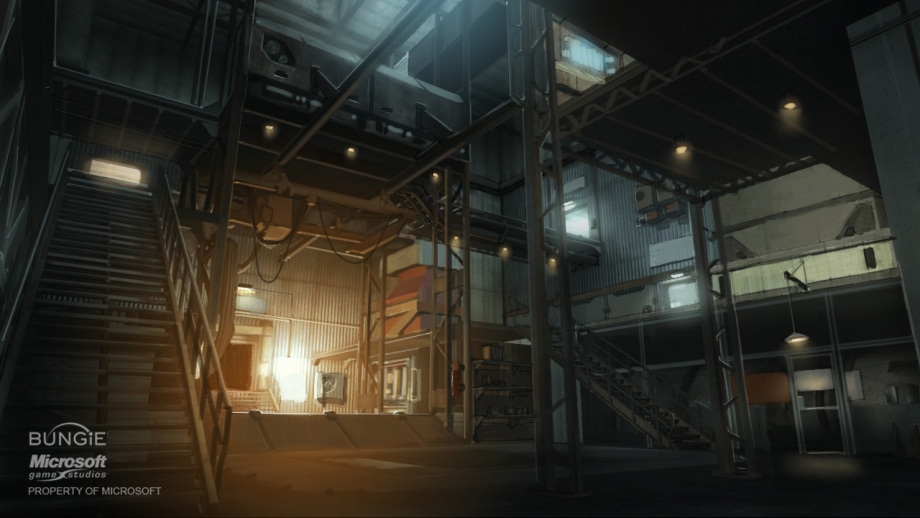
At what (x,y) coordinates should I click in order to perform the action: click on staircase. Please return your answer as a coordinate pair (x, y). Looking at the image, I should click on (141, 347), (625, 385).